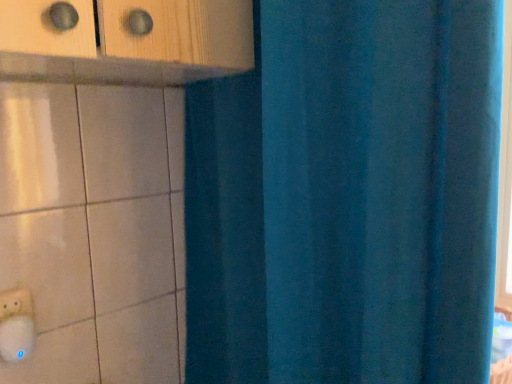
Locate an element on the screen. The width and height of the screenshot is (512, 384). blue fabric curtain at center is located at coordinates [346, 197].

This screenshot has height=384, width=512. What do you see at coordinates (346, 197) in the screenshot?
I see `blue fabric curtain at center` at bounding box center [346, 197].

At what (x,y) coordinates should I click in order to perform the action: click on blue fabric curtain at center. Please return your answer as a coordinate pair (x, y). This screenshot has height=384, width=512. Looking at the image, I should click on (346, 197).